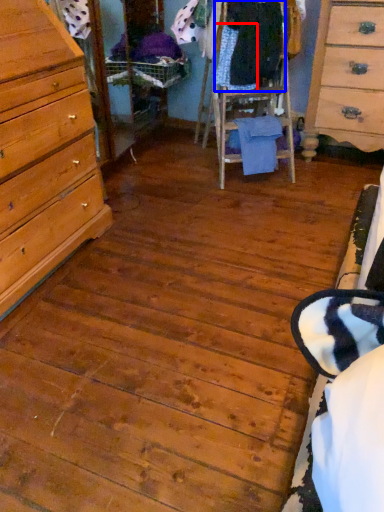
Question: Among these objects, which one is nearest to the camera, clothing (highlighted by a red box) or clothing (highlighted by a blue box)?

Choices:
 (A) clothing
 (B) clothing

Answer: (B)